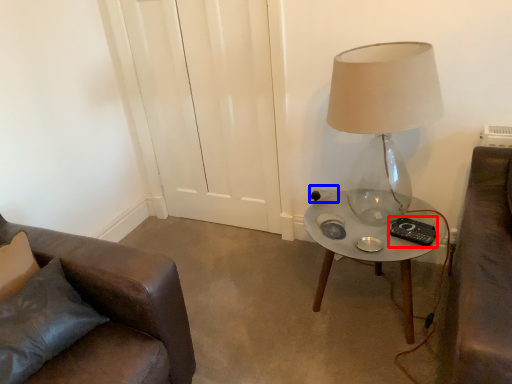
Question: Which object appears closest to the camera in this image, remote control (highlighted by a red box) or electric outlet (highlighted by a blue box)?

Choices:
 (A) remote control
 (B) electric outlet

Answer: (A)